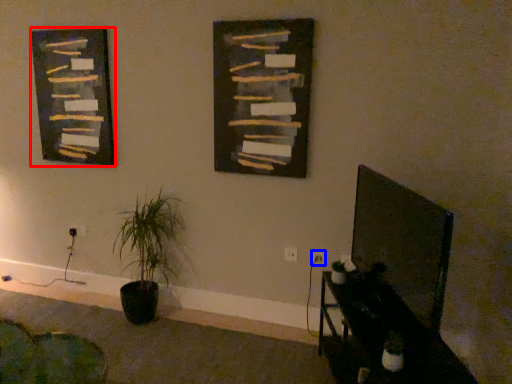
Question: Which of the following is the closest to the observer, picture frame (highlighted by a red box) or electric outlet (highlighted by a blue box)?

Choices:
 (A) picture frame
 (B) electric outlet

Answer: (B)